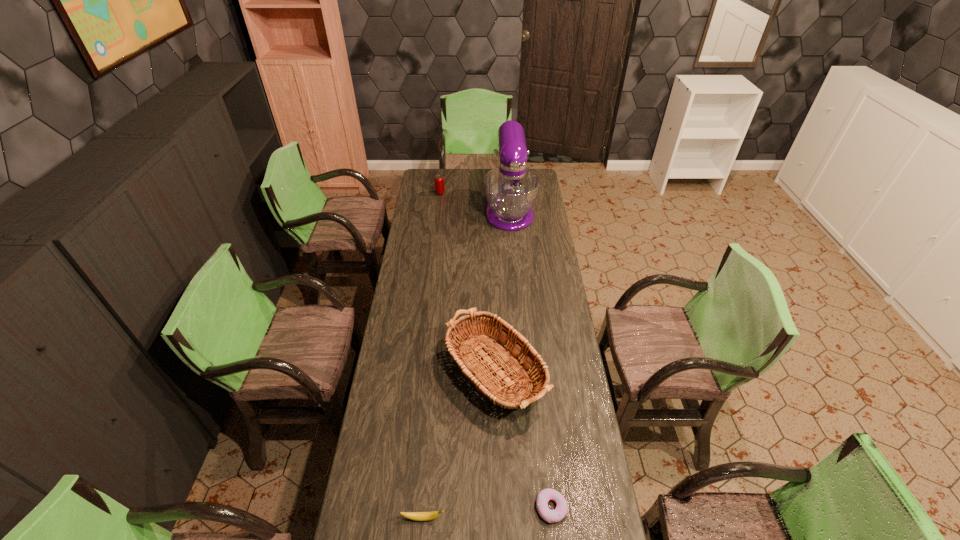
The image size is (960, 540). I want to click on vacant space at the right edge, so click(579, 421).

I want to click on free spot between the third shortest object and the fourth tallest object, so click(432, 355).

Locate an element on the screen. The width and height of the screenshot is (960, 540). vacant area that lies between the second shortest object and the can is located at coordinates (432, 355).

This screenshot has width=960, height=540. Find the location of `vacant point located between the second tallest object and the banana`. vacant point located between the second tallest object and the banana is located at coordinates (458, 441).

Locate an element on the screen. Image resolution: width=960 pixels, height=540 pixels. free space between the fourth shortest object and the can is located at coordinates (466, 279).

Image resolution: width=960 pixels, height=540 pixels. Find the location of `empty location between the second shortest object and the basket`. empty location between the second shortest object and the basket is located at coordinates (458, 441).

Where is `unoccupied position between the doughnut and the third farthest object`? The height and width of the screenshot is (540, 960). unoccupied position between the doughnut and the third farthest object is located at coordinates (521, 436).

You are a GUI agent. You are given a task and a screenshot of the screen. Output one action in this format:
    pyautogui.click(x=<x>, y=<y>)
    Task: Click on the free space between the second shortest object and the third shortest object
    This screenshot has height=540, width=960.
    Given the screenshot: What is the action you would take?
    click(x=432, y=355)

Identify which object is the second closest to the third farthest object. Please provide its 2D coordinates. Your answer should be formatted as a tuple, i.e. [(x, y)], where the tuple contains the x and y coordinates of a point satisfying the conditions above.

[(417, 516)]

The width and height of the screenshot is (960, 540). What are the coordinates of `object that is the third closest to the banana` in the screenshot? It's located at (511, 190).